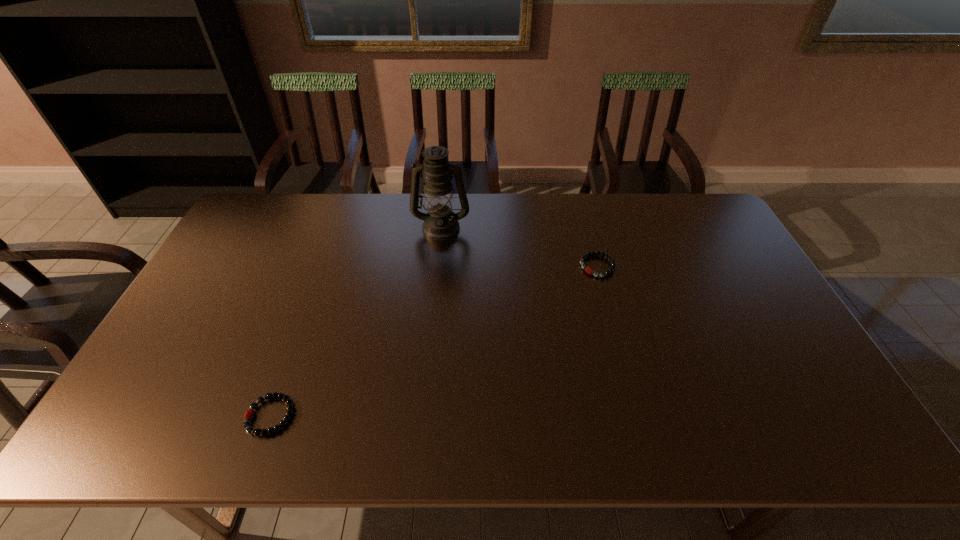
The height and width of the screenshot is (540, 960). Find the location of `the farthest object`. the farthest object is located at coordinates (440, 223).

Find the location of a particular element. the tallest object is located at coordinates (440, 223).

At what (x,y) coordinates should I click in order to perform the action: click on the right bracelet. Please return your answer as a coordinate pair (x, y). Looking at the image, I should click on [589, 270].

This screenshot has height=540, width=960. In order to click on the second farthest object in this screenshot , I will do `click(589, 270)`.

Where is `the leftmost object`? Image resolution: width=960 pixels, height=540 pixels. the leftmost object is located at coordinates (249, 415).

Locate an element on the screen. the left bracelet is located at coordinates (249, 415).

Where is `vacant space situated 0.120m on the right of the oil lamp`? vacant space situated 0.120m on the right of the oil lamp is located at coordinates (504, 227).

Identify the location of vacant region located on the right of the right bracelet. (669, 266).

Locate an element on the screen. free space located 0.050m on the back of the leftmost object is located at coordinates (285, 377).

You are a GUI agent. You are given a task and a screenshot of the screen. Output one action in this format:
    pyautogui.click(x=<x>, y=<y>)
    Task: Click on the object that is positioned at the far edge
    The height and width of the screenshot is (540, 960).
    Given the screenshot: What is the action you would take?
    pyautogui.click(x=440, y=223)